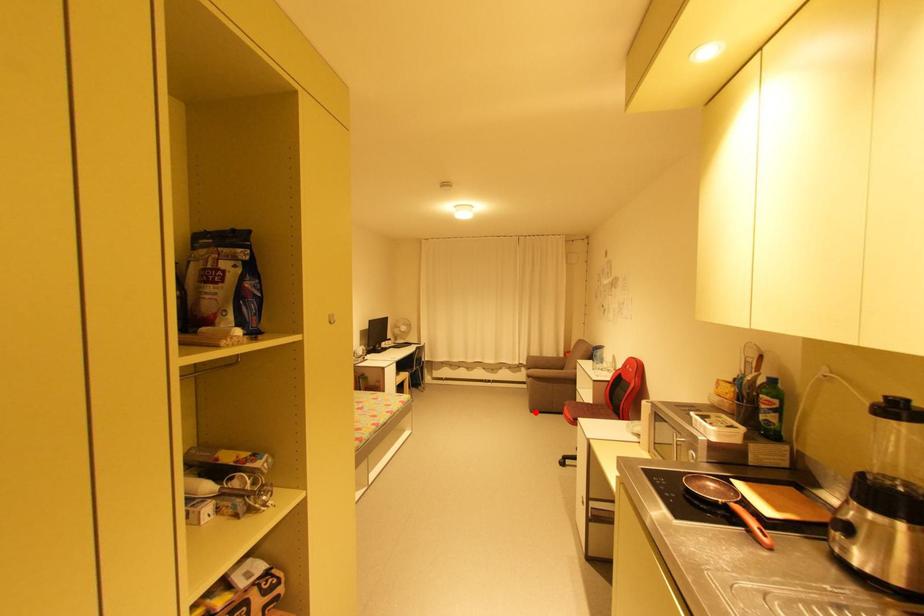
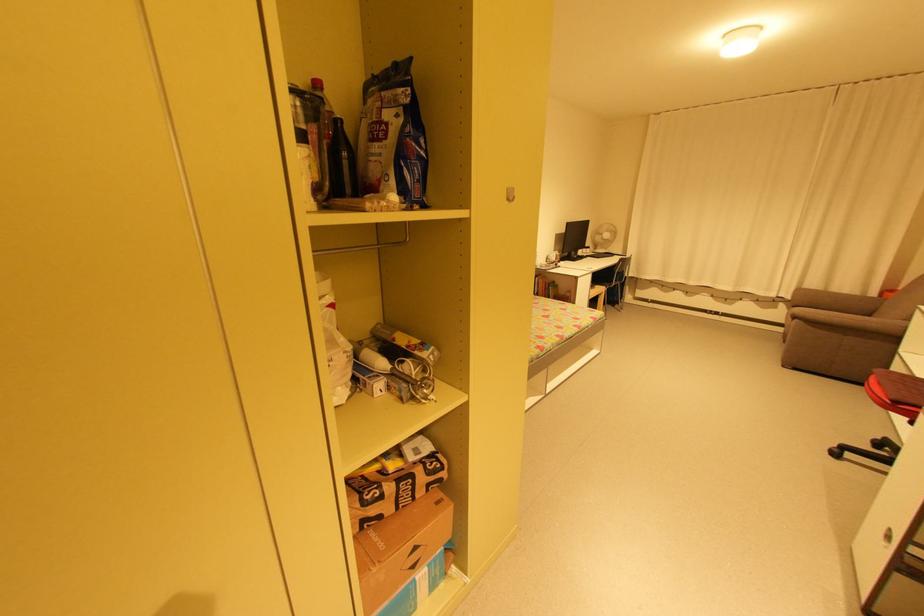
Question: I am providing you with two images of the same scene from different viewpoints. A red point is shown in image1. For the corresponding object point in image2, is it positioned nearer or farther from the camera?

Choices:
 (A) Nearer
 (B) Farther

Answer: (A)